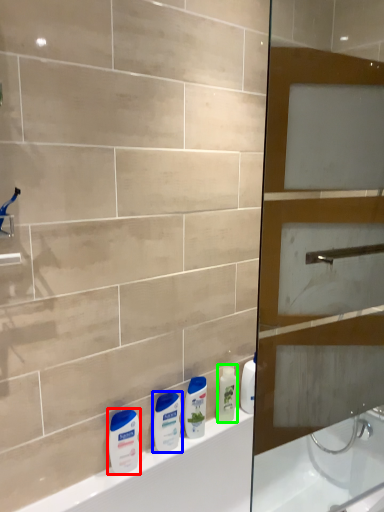
Question: Considering the real-world distances, which object is closest to toiletry (highlighted by a red box)? toiletry (highlighted by a blue box) or toiletry (highlighted by a green box).

Choices:
 (A) toiletry
 (B) toiletry

Answer: (A)